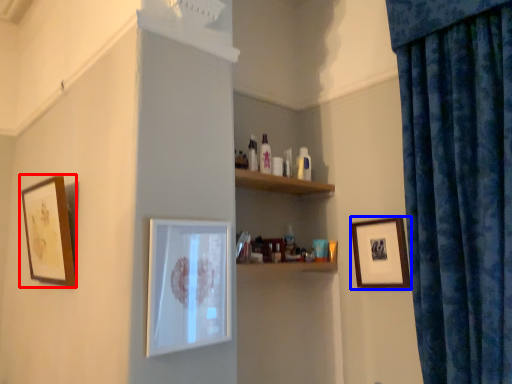
Question: Among these objects, which one is farthest to the camera, picture frame (highlighted by a red box) or picture frame (highlighted by a blue box)?

Choices:
 (A) picture frame
 (B) picture frame

Answer: (B)